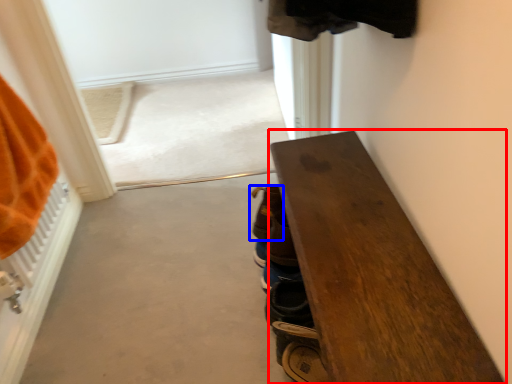
Question: Among these objects, which one is farthest to the camera, furniture (highlighted by a red box) or footwear (highlighted by a blue box)?

Choices:
 (A) furniture
 (B) footwear

Answer: (B)